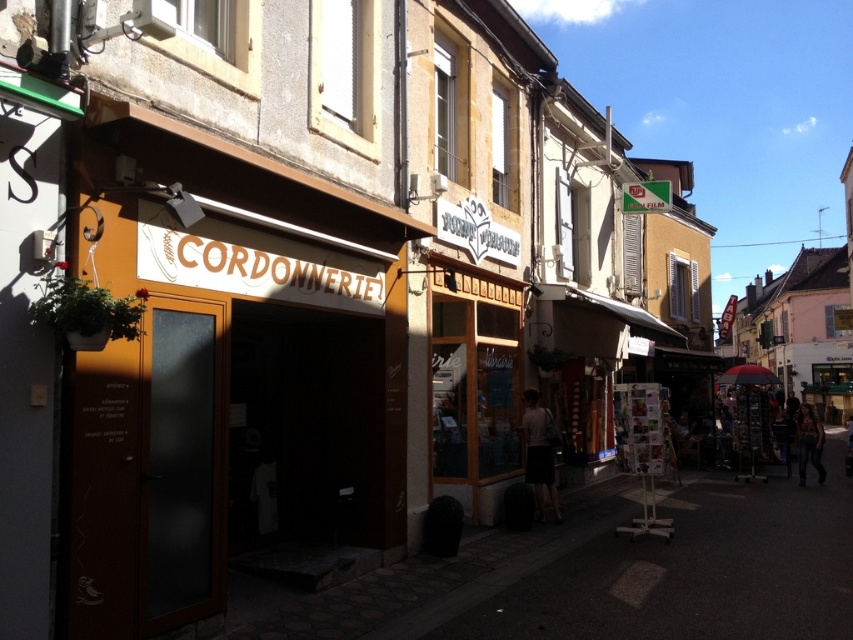
Question: Is matte orange signboard at center closer to camera compared to white cotton shirt at center?

Choices:
 (A) no
 (B) yes

Answer: (B)

Question: Is white cotton shirt at center behind denim jeans at lower right?

Choices:
 (A) no
 (B) yes

Answer: (A)

Question: Which object appears farthest from the camera in this image?

Choices:
 (A) denim jeans at lower right
 (B) white cotton shirt at center
 (C) matte orange signboard at center

Answer: (A)

Question: Does white cotton shirt at center appear over denim jeans at lower right?

Choices:
 (A) yes
 (B) no

Answer: (A)

Question: Which point is closer to the camera taking this photo?

Choices:
 (A) (158, 195)
 (B) (809, 452)
 (C) (538, 404)

Answer: (A)

Question: Which is nearer to the white cotton shirt at center?

Choices:
 (A) denim jeans at lower right
 (B) matte orange signboard at center

Answer: (B)